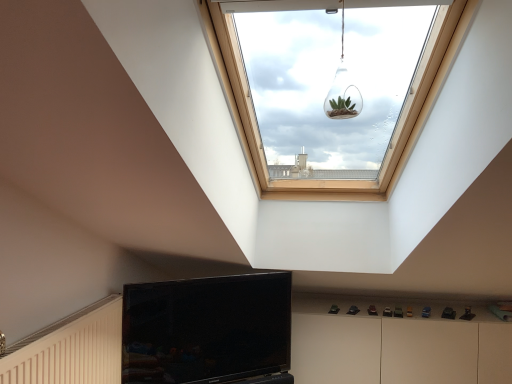
Question: Can we say white glossy dresser at lower right lies outside clear glass terrarium at upper center?

Choices:
 (A) no
 (B) yes

Answer: (B)

Question: Does white glossy dresser at lower right appear on the left side of clear glass terrarium at upper center?

Choices:
 (A) no
 (B) yes

Answer: (A)

Question: From a real-world perspective, is white glossy dresser at lower right positioned over clear glass terrarium at upper center based on gravity?

Choices:
 (A) no
 (B) yes

Answer: (A)

Question: Is white glossy dresser at lower right with clear glass terrarium at upper center?

Choices:
 (A) no
 (B) yes

Answer: (A)

Question: Does white glossy dresser at lower right turn towards clear glass terrarium at upper center?

Choices:
 (A) yes
 (B) no

Answer: (B)

Question: From the image's perspective, is white glossy dresser at lower right beneath clear glass terrarium at upper center?

Choices:
 (A) no
 (B) yes

Answer: (B)

Question: From the image's perspective, would you say white glossy dresser at lower right is shown under black glossy tv at lower center?

Choices:
 (A) no
 (B) yes

Answer: (B)

Question: Does white glossy dresser at lower right have a lesser width compared to black glossy tv at lower center?

Choices:
 (A) yes
 (B) no

Answer: (B)

Question: From the image's perspective, is white glossy dresser at lower right on black glossy tv at lower center?

Choices:
 (A) no
 (B) yes

Answer: (A)

Question: Is white glossy dresser at lower right positioned beyond the bounds of black glossy tv at lower center?

Choices:
 (A) no
 (B) yes

Answer: (B)

Question: From a real-world perspective, is white glossy dresser at lower right on top of black glossy tv at lower center?

Choices:
 (A) yes
 (B) no

Answer: (B)

Question: Could you tell me if white glossy dresser at lower right is turned towards black glossy tv at lower center?

Choices:
 (A) no
 (B) yes

Answer: (A)

Question: Considering the relative sizes of clear glass terrarium at upper center and white glossy dresser at lower right in the image provided, is clear glass terrarium at upper center wider than white glossy dresser at lower right?

Choices:
 (A) no
 (B) yes

Answer: (A)